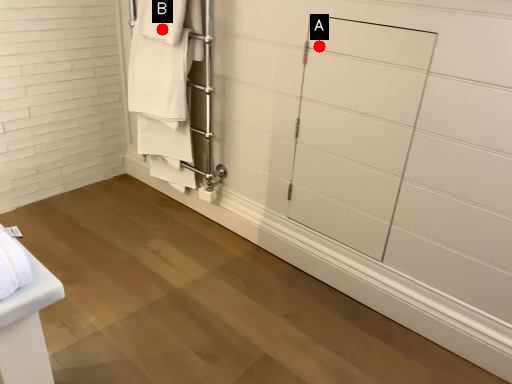
Question: Two points are circled on the image, labeled by A and B beside each circle. Which point is farther from the camera taking this photo?

Choices:
 (A) A is further
 (B) B is further

Answer: (B)